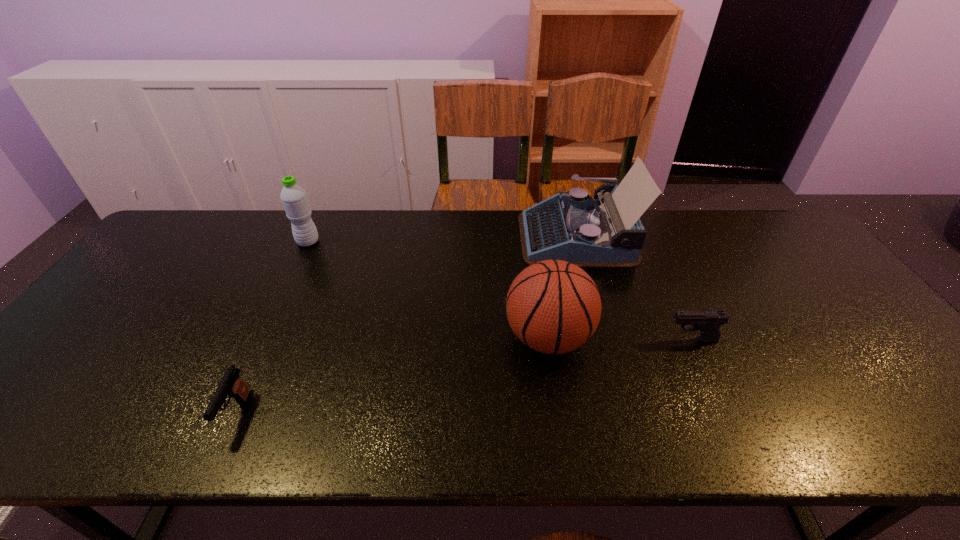
What are the coordinates of `free space that is in between the water bottle and the basketball` in the screenshot? It's located at (428, 290).

I want to click on free area in between the nearest object and the typewriter, so click(406, 325).

Locate an element on the screen. vacant area that lies between the water bottle and the right pistol is located at coordinates (500, 291).

The image size is (960, 540). I want to click on blank region between the water bottle and the left pistol, so click(273, 328).

Choose which object is the third nearest neighbor to the farther pistol. Please provide its 2D coordinates. Your answer should be formatted as a tuple, i.e. [(x, y)], where the tuple contains the x and y coordinates of a point satisfying the conditions above.

[(231, 385)]

Choose which object is the fourth nearest neighbor to the right pistol. Please provide its 2D coordinates. Your answer should be formatted as a tuple, i.e. [(x, y)], where the tuple contains the x and y coordinates of a point satisfying the conditions above.

[(294, 199)]

Find the location of a particular element. free point that satisfies the following two spatial constraints: 1. at the barrel of the right pistol; 2. at the barrel of the nearer pistol is located at coordinates (727, 414).

What are the coordinates of `free space that satisfies the following two spatial constraints: 1. on the typing side of the typewriter; 2. at the barrel of the nearer pistol` in the screenshot? It's located at (624, 414).

The height and width of the screenshot is (540, 960). Identify the location of free spot that satisfies the following two spatial constraints: 1. at the barrel of the farther pistol; 2. at the barrel of the nearer pistol. (727, 414).